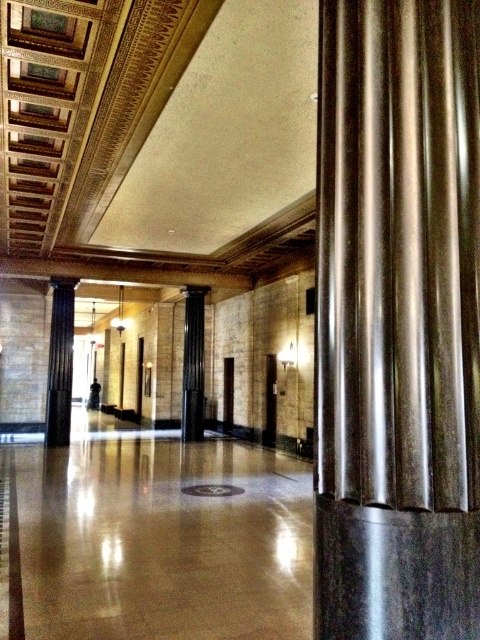
Locate an element on the screen. The width and height of the screenshot is (480, 640). metallic polished column at center is located at coordinates (397, 321).

The height and width of the screenshot is (640, 480). What do you see at coordinates (397, 321) in the screenshot?
I see `metallic polished column at center` at bounding box center [397, 321].

The image size is (480, 640). I want to click on metallic polished column at center, so click(397, 321).

Which is in front, point (57, 445) or point (194, 314)?

Point (57, 445) is in front.

Between point (69, 365) and point (200, 404), which one is positioned behind?

Positioned behind is point (200, 404).

Does point (60, 403) lie behind point (187, 332)?

No, (60, 403) is in front of (187, 332).

Where is `black polished column at left`? The width and height of the screenshot is (480, 640). black polished column at left is located at coordinates (60, 362).

Between point (459, 288) and point (194, 316), which one is positioned behind?

Point (194, 316)

Measure the distance between point (317, 564) and camera.

They are 5.43 feet apart.

Locate an element on the screen. The image size is (480, 640). metallic polished column at center is located at coordinates (397, 321).